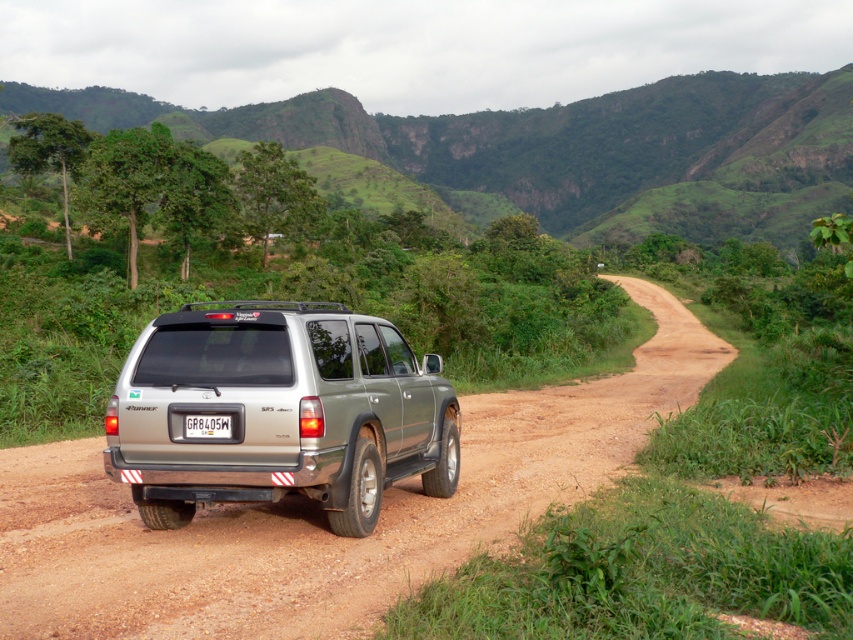
Looking at this image, you are a driver who wants to know if the green grassy hillside at upper center is higher than the white plastic license plate at rear. Based on the scene, can you confirm this?

The green grassy hillside at upper center is taller than the white plastic license plate at rear, so yes, the green grassy hillside at upper center is higher than the white plastic license plate at rear.

In the scene shown: You are a photographer planning to capture the Toyota 4Runner parked on the dirt road. You need to ensure that both the green grassy hillside at upper center and the white plastic license plate at rear are visible in your shot. Based on their widths, which object will occupy more space horizontally in the photo?

The green grassy hillside at upper center will occupy more space horizontally in the photo because its width surpasses that of the white plastic license plate at rear.